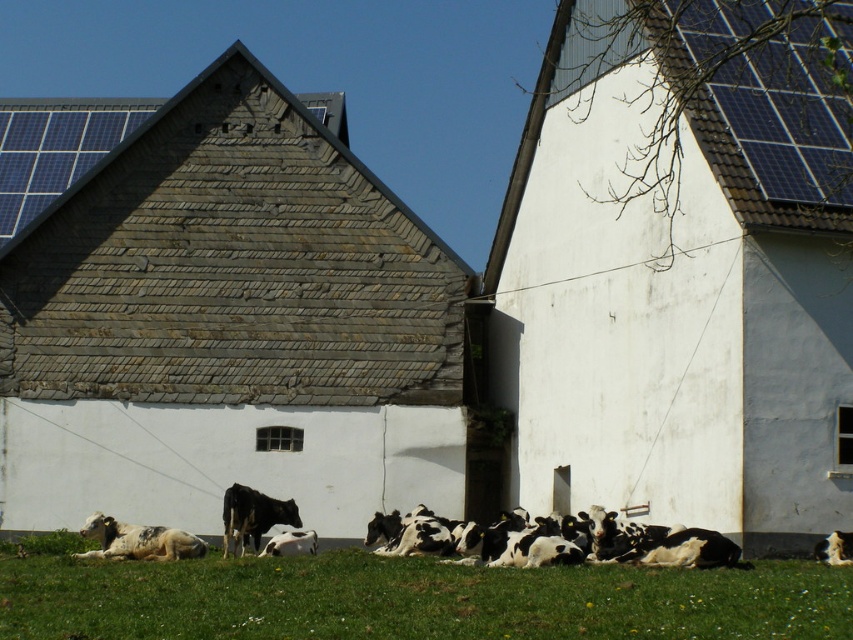
Does white matte barn at lower right have a lesser height compared to black-and-white spotted cows at center?

No, white matte barn at lower right is not shorter than black-and-white spotted cows at center.

Is point (682, 452) closer to camera compared to point (575, 560)?

No, (682, 452) is behind (575, 560).

Where is `white matte barn at lower right`? The width and height of the screenshot is (853, 640). white matte barn at lower right is located at coordinates pos(676,304).

How much distance is there between rustic stone barn at center and black-and-white spotted cows at center?

rustic stone barn at center and black-and-white spotted cows at center are 13.92 meters apart from each other.

Does point (158, 232) come behind point (650, 552)?

That is True.

The image size is (853, 640). I want to click on rustic stone barn at center, so [x=228, y=326].

Between rustic stone barn at center and green grass at lower center, which one is positioned higher?

Positioned higher is rustic stone barn at center.

Is point (343, 285) closer to camera compared to point (401, 609)?

No, it is behind (401, 609).

Locate an element on the screen. rustic stone barn at center is located at coordinates (228, 326).